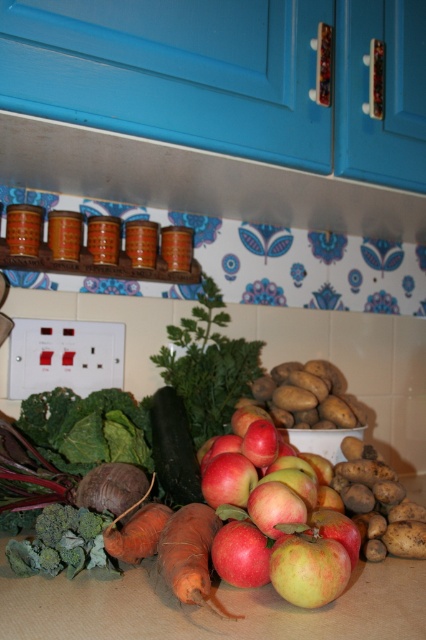
Question: Is red matte apples at center further to the viewer compared to yellow-green matte apple at center?

Choices:
 (A) yes
 (B) no

Answer: (B)

Question: Which object appears farthest from the camera in this image?

Choices:
 (A) red matte apples at center
 (B) green matte cucumber at center
 (C) yellow-green matte apple at center

Answer: (B)

Question: Among these points, which one is nearest to the camera?

Choices:
 (A) click(x=175, y=444)
 (B) click(x=334, y=588)
 (C) click(x=189, y=518)

Answer: (B)

Question: Does red matte apples at center have a greater width compared to green matte cucumber at center?

Choices:
 (A) yes
 (B) no

Answer: (A)

Question: Based on their relative distances, which object is nearer to the red matte apples at center?

Choices:
 (A) orange matte carrot at center
 (B) yellow-green matte apple at center
 (C) green matte cucumber at center

Answer: (B)

Question: Where is red matte apples at center located in relation to yellow-green matte apple at center in the image?

Choices:
 (A) right
 (B) left

Answer: (B)